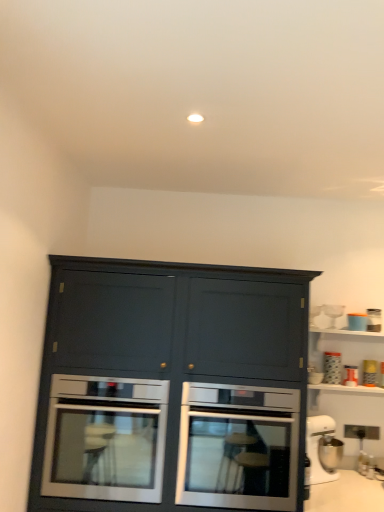
Question: Considering the relative sizes of clear glass wine glass at upper right, which is the 1th appliance in top-to-bottom order, and matte dark blue cabinet at center in the image provided, is clear glass wine glass at upper right, which is the 1th appliance in top-to-bottom order, taller than matte dark blue cabinet at center?

Choices:
 (A) no
 (B) yes

Answer: (A)

Question: Is clear glass wine glass at upper right, the seventh appliance in the bottom-to-top sequence, placed right next to matte dark blue cabinet at center?

Choices:
 (A) yes
 (B) no

Answer: (B)

Question: Does clear glass wine glass at upper right, which is the 1th appliance in top-to-bottom order, have a greater width compared to matte dark blue cabinet at center?

Choices:
 (A) no
 (B) yes

Answer: (A)

Question: From a real-world perspective, is clear glass wine glass at upper right, the seventh appliance in the bottom-to-top sequence, physically above matte dark blue cabinet at center?

Choices:
 (A) no
 (B) yes

Answer: (B)

Question: Is clear glass wine glass at upper right, which is the 1th appliance in top-to-bottom order, turned away from matte dark blue cabinet at center?

Choices:
 (A) no
 (B) yes

Answer: (A)

Question: In terms of height, does stainless steel oven at center, which is counted as the 1th oven, starting from the right, look taller or shorter compared to matte dark blue cabinet at center?

Choices:
 (A) short
 (B) tall

Answer: (A)

Question: Considering the relative positions of stainless steel oven at center, which is counted as the 1th oven, starting from the right, and matte dark blue cabinet at center in the image provided, is stainless steel oven at center, which is counted as the 1th oven, starting from the right, to the left or to the right of matte dark blue cabinet at center?

Choices:
 (A) right
 (B) left

Answer: (A)

Question: From a real-world perspective, is stainless steel oven at center, which appears as the second oven when viewed from the left, positioned above or below matte dark blue cabinet at center?

Choices:
 (A) above
 (B) below

Answer: (B)

Question: From the image's perspective, is stainless steel oven at center, which is counted as the 1th oven, starting from the right, located above or below matte dark blue cabinet at center?

Choices:
 (A) below
 (B) above

Answer: (A)

Question: Based on their positions, is clear glass wine glass at upper right, the seventh appliance in the bottom-to-top sequence, located to the left or right of white plastic stand mixer at lower right, the first appliance positioned from the bottom?

Choices:
 (A) left
 (B) right

Answer: (B)

Question: From a real-world perspective, is clear glass wine glass at upper right, the seventh appliance in the bottom-to-top sequence, positioned above or below white plastic stand mixer at lower right, which is the 7th appliance from top to bottom?

Choices:
 (A) below
 (B) above

Answer: (B)

Question: Is clear glass wine glass at upper right, which is the 1th appliance in top-to-bottom order, in front of or behind white plastic stand mixer at lower right, which is the 7th appliance from top to bottom, in the image?

Choices:
 (A) behind
 (B) front

Answer: (A)

Question: Looking at their shapes, would you say clear glass wine glass at upper right, the seventh appliance in the bottom-to-top sequence, is wider or thinner than white plastic stand mixer at lower right, which is the 7th appliance from top to bottom?

Choices:
 (A) thin
 (B) wide

Answer: (A)

Question: Relative to orange matte jar at upper right, the 5th appliance in the top-to-bottom sequence, is metallic silver toaster at upper right, which ranks as the 6th appliance in top-to-bottom order, in front or behind?

Choices:
 (A) front
 (B) behind

Answer: (B)

Question: Is point (372, 380) positioned closer to the camera than point (354, 368)?

Choices:
 (A) farther
 (B) closer

Answer: (B)